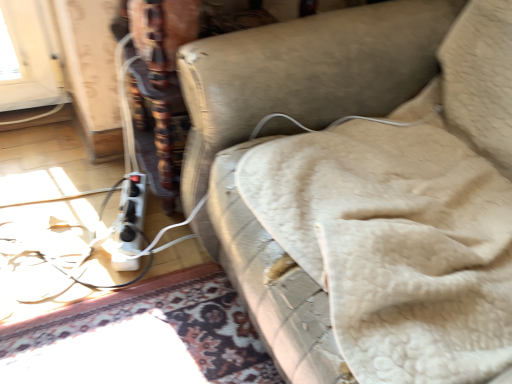
Question: From a real-world perspective, is leather couch at center physically located above or below white plastic extension cord at lower left?

Choices:
 (A) above
 (B) below

Answer: (A)

Question: Considering the positions of leather couch at center and white plastic extension cord at lower left in the image, is leather couch at center bigger or smaller than white plastic extension cord at lower left?

Choices:
 (A) small
 (B) big

Answer: (B)

Question: From the image's perspective, is leather couch at center positioned above or below white plastic extension cord at lower left?

Choices:
 (A) above
 (B) below

Answer: (A)

Question: Considering the relative positions of white plastic extension cord at lower left and leather couch at center in the image provided, is white plastic extension cord at lower left to the left or to the right of leather couch at center?

Choices:
 (A) left
 (B) right

Answer: (A)

Question: In terms of size, does white plastic extension cord at lower left appear bigger or smaller than leather couch at center?

Choices:
 (A) small
 (B) big

Answer: (A)

Question: In the image, is white plastic extension cord at lower left positioned in front of or behind leather couch at center?

Choices:
 (A) front
 (B) behind

Answer: (B)

Question: Considering the positions of white plastic extension cord at lower left and leather couch at center in the image, is white plastic extension cord at lower left taller or shorter than leather couch at center?

Choices:
 (A) tall
 (B) short

Answer: (B)